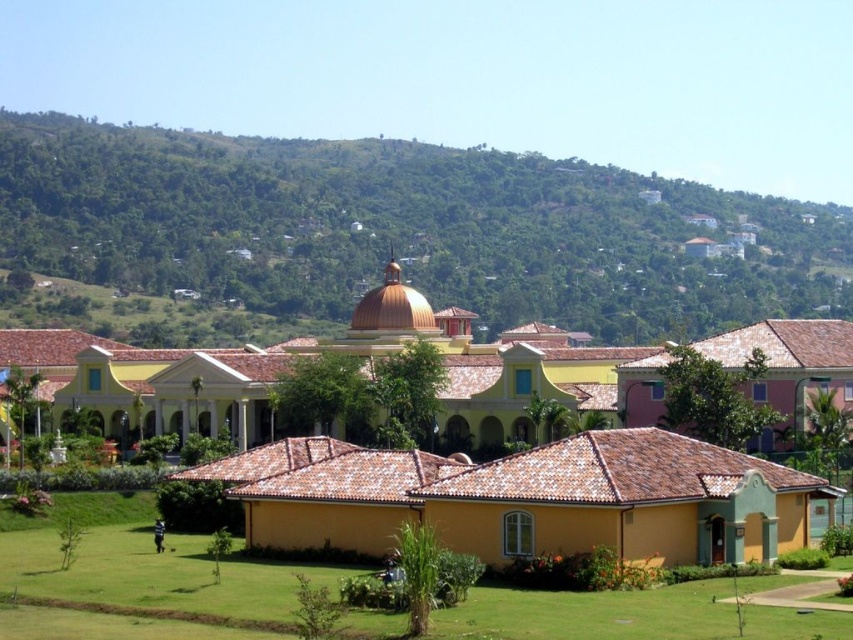
You are standing on the green grass lawn at lower left and want to reach the green leafy hillside at upper center. Which direction should you move to ascend towards the hillside?

You should move towards the upper center direction to ascend towards the green leafy hillside at upper center since it is higher than the green grass lawn at lower left.

You are planning to plant a new garden in the area shown in the image. You have two options for locations based on the green leafy hillside at upper center and the green grass lawn at lower left. Which location offers more space for planting a larger garden?

The green leafy hillside at upper center is larger in size than the green grass lawn at lower left, so it offers more space for planting a larger garden.